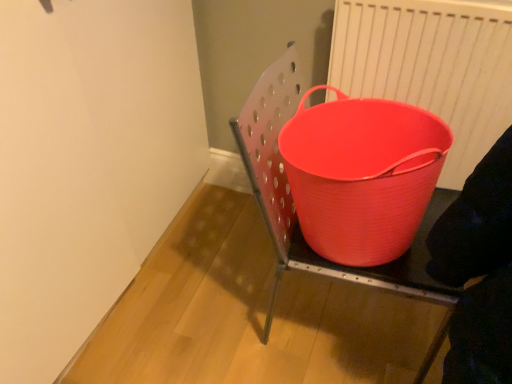
In order to click on vacant area on top of matte plastic bucket at right (from a real-world perspective) in this screenshot , I will do `click(245, 302)`.